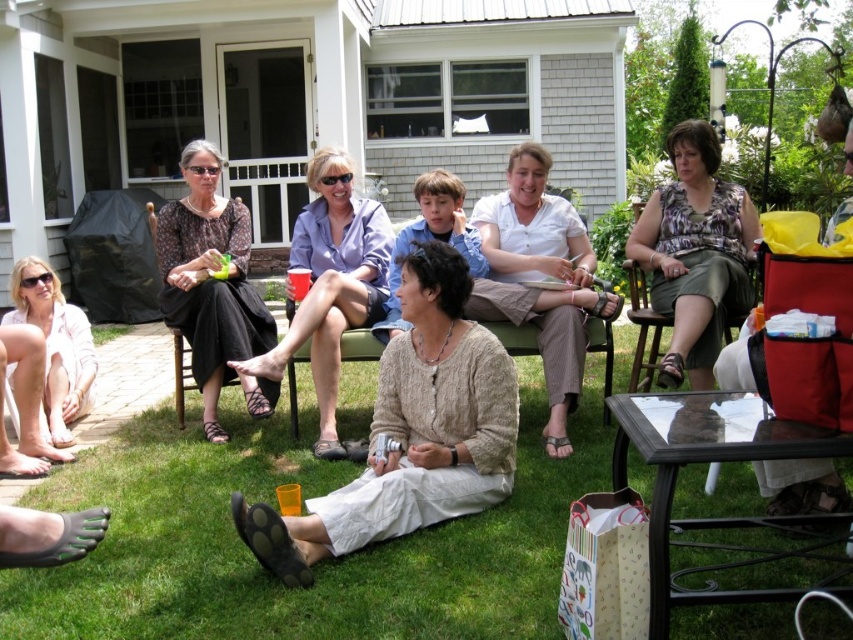
Question: Does printed cotton blouse at center appear over translucent plastic cup at center?

Choices:
 (A) no
 (B) yes

Answer: (B)

Question: Which point is farther to the camera?

Choices:
 (A) printed cotton blouse at left
 (B) pink cotton shirt at lower left

Answer: (B)

Question: Is printed cotton blouse at center smaller than green matte cup at center?

Choices:
 (A) no
 (B) yes

Answer: (A)

Question: Is white cotton shirt at center wider than translucent plastic cup at center?

Choices:
 (A) no
 (B) yes

Answer: (B)

Question: Which object appears closest to the camera in this image?

Choices:
 (A) translucent plastic cup at center
 (B) knitted beige sweater at center
 (C) printed cotton blouse at left

Answer: (B)

Question: Which point is farther to the camera?

Choices:
 (A) pink cotton shirt at lower left
 (B) knitted beige sweater at center

Answer: (A)